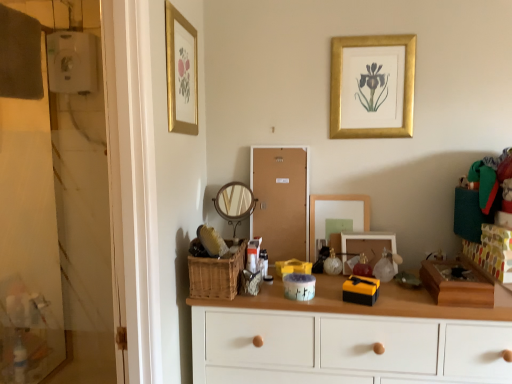
Question: Based on their positions, is white wood chest of drawers at center located to the left or right of wooden round mirror at center, acting as the second mirror starting from the right?

Choices:
 (A) right
 (B) left

Answer: (A)

Question: Based on their sizes in the image, would you say white wood chest of drawers at center is bigger or smaller than wooden round mirror at center, placed as the 1th mirror when sorted from left to right?

Choices:
 (A) big
 (B) small

Answer: (A)

Question: Which object is positioned closest to the wooden picture frame at center, the 2th picture frame from the left?

Choices:
 (A) gold framed print at upper left, which appears as the first picture frame when viewed from the left
 (B) matte glass mirror at center, which ranks as the 1th mirror in right-to-left order
 (C) white wood chest of drawers at center
 (D) corkboard at center
 (E) shiny metallic toy at center

Answer: (E)

Question: Based on their relative distances, which object is nearer to the woven brown basket at center?

Choices:
 (A) wooden round mirror at center, acting as the second mirror starting from the right
 (B) matte glass mirror at center, which ranks as the 1th mirror in right-to-left order
 (C) translucent plastic container at center
 (D) gold metallic picture frame at upper center, which is the 1th picture frame in right-to-left order
 (E) shiny metallic toy at center

Answer: (C)